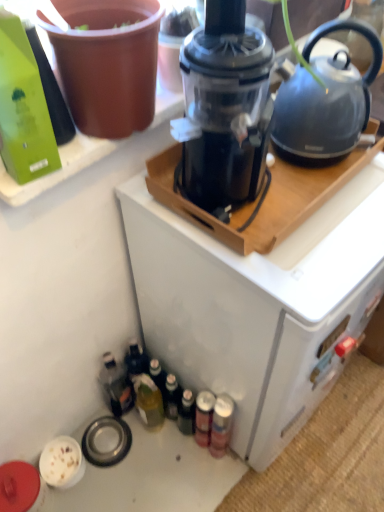
At what (x,y) coordinates should I click in order to perform the action: click on free space in front of translucent plastic bottle at lower left, which is the third bottle in front-to-back order. Please return your answer as a coordinate pair (x, y). This screenshot has height=512, width=384. Looking at the image, I should click on (132, 470).